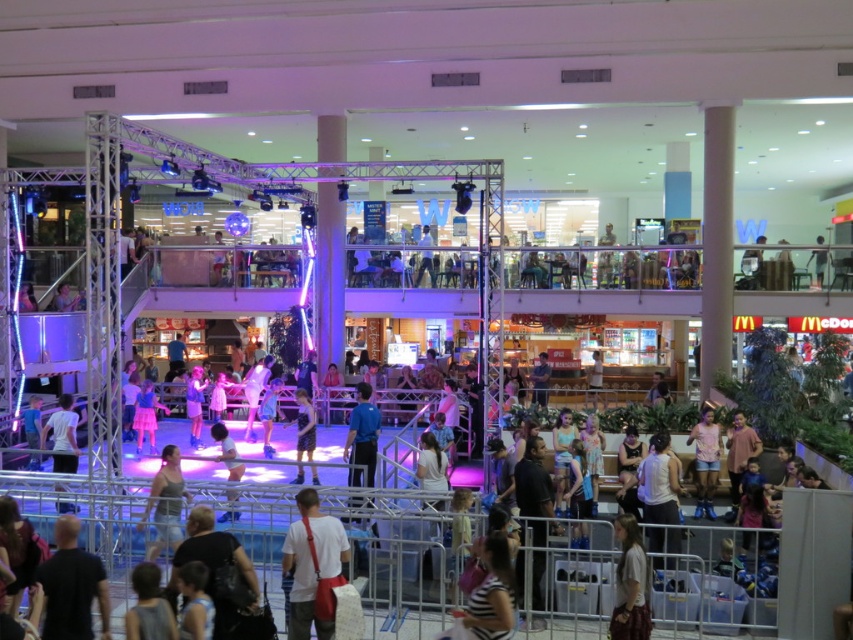
You are a photographer positioned at the center of the shopping mall. You want to capture a photo of both the black matte shirt at lower left and the light brown fabric dress at lower right in the same frame. What is the minimum distance you need to move backward to ensure both subjects are fully visible in your camera view?

To include both the black matte shirt at lower left and the light brown fabric dress at lower right in the same frame, the photographer must move back at least 15 feet to cover the 14.94 feet distance between them.

You are at the shopping mall event and notice two performers wearing black matte shirt at lower left and white matte shirt at lower left. Which performer is positioned more to the left side?

The white matte shirt at lower left is positioned more to the left side since the black matte shirt at lower left is to its right.

You are standing in the shopping mall and want to reach the point marked as point (64,618). If you walk straight ahead, will you reach it before walking 8 meters?

The point (64,618) is 7.30 meters away from the viewer. Since 7.30 meters is less than 8 meters, you will reach it before walking 8 meters.